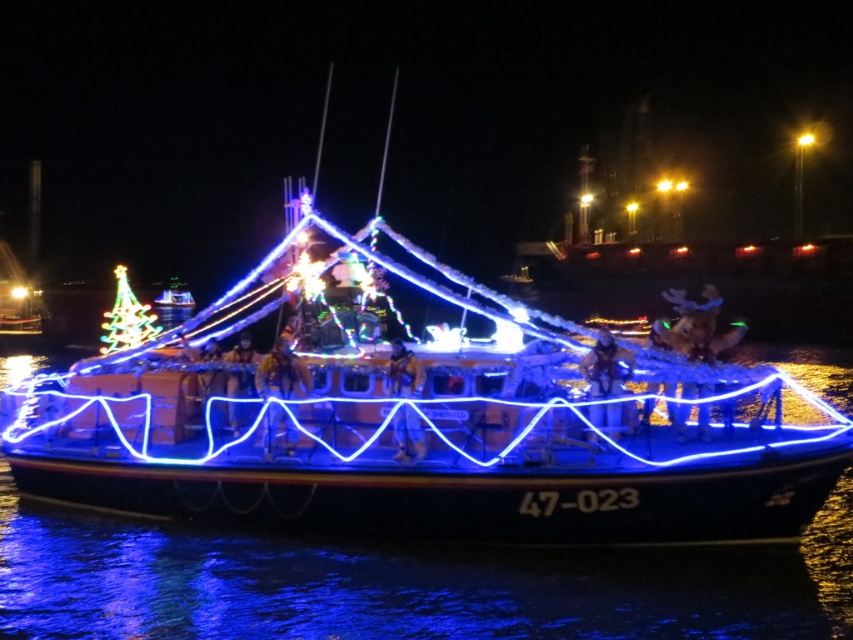
Is metallic gold helmet at center shorter than matte gold helmet at center?

No, metallic gold helmet at center is not shorter than matte gold helmet at center.

Does metallic gold helmet at center have a lesser width compared to matte gold helmet at center?

In fact, metallic gold helmet at center might be wider than matte gold helmet at center.

Locate an element on the screen. Image resolution: width=853 pixels, height=640 pixels. metallic gold helmet at center is located at coordinates (606, 365).

Where is `metallic gold helmet at center`? The width and height of the screenshot is (853, 640). metallic gold helmet at center is located at coordinates (x=606, y=365).

Looking at this image, does blue reflective water at center appear over yellow fabric jacket at center?

No.

Who is more forward, (740, 636) or (397, 417)?

Point (740, 636) is more forward.

Is point (316, 540) positioned in front of point (415, 365)?

That is True.

The width and height of the screenshot is (853, 640). I want to click on blue reflective water at center, so click(405, 582).

Is point (633, 580) farther from camera compared to point (611, 364)?

No, (633, 580) is in front of (611, 364).

Image resolution: width=853 pixels, height=640 pixels. Describe the element at coordinates (405, 582) in the screenshot. I see `blue reflective water at center` at that location.

In order to click on blue reflective water at center in this screenshot , I will do `click(405, 582)`.